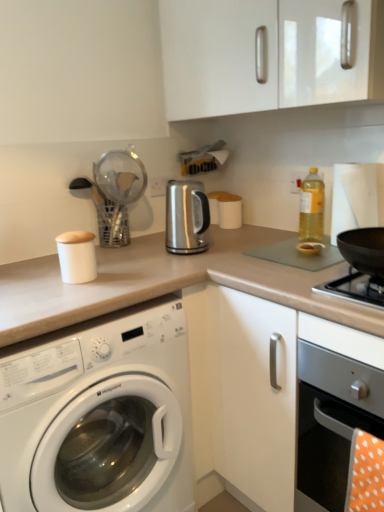
Question: Are black matte wok at right and satin silver oven at lower right located far from each other?

Choices:
 (A) no
 (B) yes

Answer: (A)

Question: Does black matte wok at right appear on the left side of satin silver oven at lower right?

Choices:
 (A) no
 (B) yes

Answer: (B)

Question: Is black matte wok at right further to camera compared to satin silver oven at lower right?

Choices:
 (A) yes
 (B) no

Answer: (A)

Question: Considering the relative positions of black matte wok at right and satin silver oven at lower right in the image provided, is black matte wok at right to the right of satin silver oven at lower right from the viewer's perspective?

Choices:
 (A) yes
 (B) no

Answer: (B)

Question: Does black matte wok at right have a lesser width compared to satin silver oven at lower right?

Choices:
 (A) no
 (B) yes

Answer: (B)

Question: Does point (317, 207) appear closer or farther from the camera than point (317, 45)?

Choices:
 (A) farther
 (B) closer

Answer: (A)

Question: From a real-world perspective, is yellow translucent bottle at upper right positioned above or below white glossy cabinet at upper center?

Choices:
 (A) above
 (B) below

Answer: (B)

Question: From the image's perspective, relative to white glossy cabinet at upper center, is yellow translucent bottle at upper right above or below?

Choices:
 (A) above
 (B) below

Answer: (B)

Question: Considering their positions, is yellow translucent bottle at upper right located in front of or behind white glossy cabinet at upper center?

Choices:
 (A) behind
 (B) front

Answer: (A)

Question: Considering the positions of white glossy cabinet at upper center and white glossy washing machine at lower left in the image, is white glossy cabinet at upper center taller or shorter than white glossy washing machine at lower left?

Choices:
 (A) tall
 (B) short

Answer: (B)

Question: From a real-world perspective, is white glossy cabinet at upper center positioned above or below white glossy washing machine at lower left?

Choices:
 (A) below
 (B) above

Answer: (B)

Question: Is point (223, 53) closer or farther from the camera than point (152, 443)?

Choices:
 (A) closer
 (B) farther

Answer: (B)

Question: Is white glossy cabinet at upper center wider or thinner than white glossy washing machine at lower left?

Choices:
 (A) wide
 (B) thin

Answer: (B)

Question: From their relative heights in the image, would you say black matte wok at right is taller or shorter than white glossy washing machine at lower left?

Choices:
 (A) short
 (B) tall

Answer: (A)

Question: Is black matte wok at right wider or thinner than white glossy washing machine at lower left?

Choices:
 (A) thin
 (B) wide

Answer: (A)